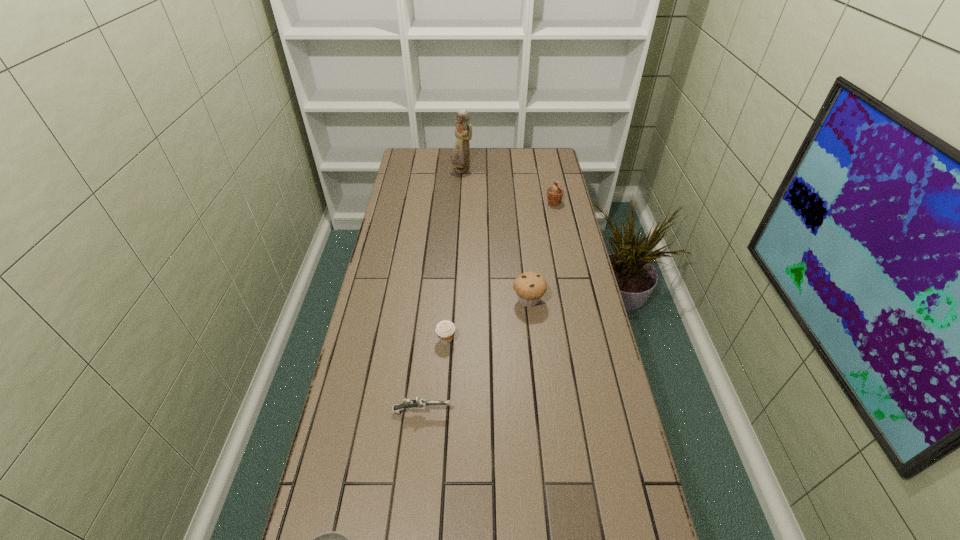
Identify the location of muffin that is the second closest to the leftmost object. (530, 286).

Locate an element on the screen. The width and height of the screenshot is (960, 540). vacant space that satisfies the following two spatial constraints: 1. on the front-facing side of the third farthest object; 2. on the right side of the figurine is located at coordinates (455, 300).

The image size is (960, 540). Find the location of `vacant space that satisfies the following two spatial constraints: 1. on the front-facing side of the third farthest object; 2. on the left side of the tallest object`. vacant space that satisfies the following two spatial constraints: 1. on the front-facing side of the third farthest object; 2. on the left side of the tallest object is located at coordinates (455, 300).

Locate an element on the screen. Image resolution: width=960 pixels, height=540 pixels. vacant space that satisfies the following two spatial constraints: 1. on the back side of the third farthest object; 2. on the right side of the third nearest object is located at coordinates (449, 300).